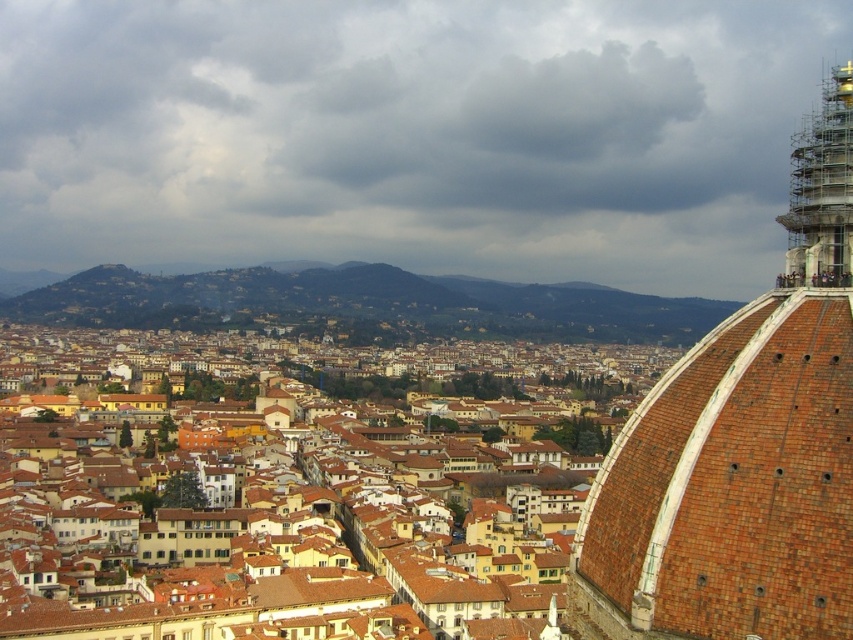
Is point (724, 592) in front of point (807, 269)?

Yes.

In the scene shown: Is red brick dome at right above scaffolding metal spire at upper right?

Actually, red brick dome at right is below scaffolding metal spire at upper right.

Which is behind, point (837, 625) or point (842, 260)?

The point (842, 260) is behind.

At what (x,y) coordinates should I click in order to perform the action: click on red brick dome at right. Please return your answer as a coordinate pair (x, y). This screenshot has height=640, width=853. Looking at the image, I should click on (741, 448).